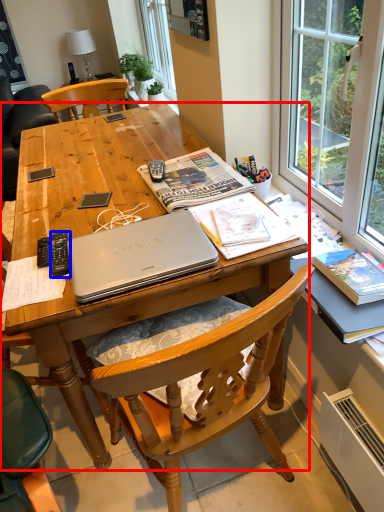
Question: Which of the following is the closest to the observer, desk (highlighted by a red box) or remote control (highlighted by a blue box)?

Choices:
 (A) desk
 (B) remote control

Answer: (A)